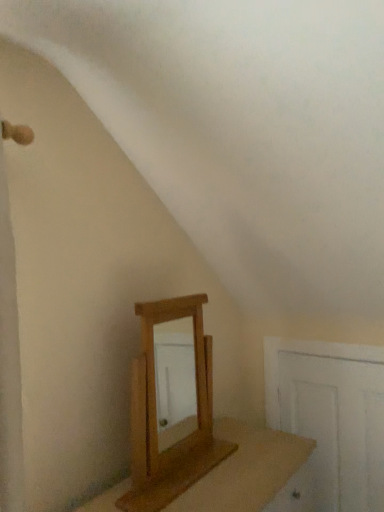
Locate an element on the screen. The width and height of the screenshot is (384, 512). free location to the right of light brown wooden mirror at center is located at coordinates (252, 461).